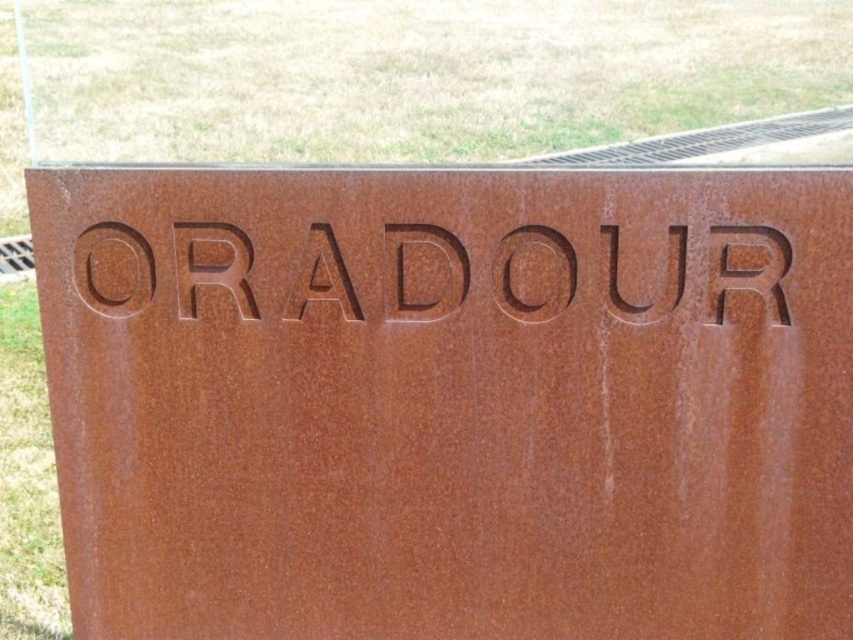
You are a landscape designer planning to place a new bench in the garden. The bench requires a space wider than the rusty metal sign at center but narrower than the brown grass at upper center. Is there enough space between them for the bench?

The rusty metal sign at center is narrower than the brown grass at upper center. Since the bench requires a space wider than the sign but narrower than the grass area, there is sufficient space between their widths to accommodate the bench.

You are standing in a field and see the rusty metal sign at center. If you walk directly towards the sign, will you first encounter the grass or the sign?

The rusty metal sign at center is located at point (450, 403), so you will first encounter the sign before the grass since it is positioned closer to your viewpoint.

You are standing in a field and see the rusty metal sign at center and the brown grass at upper center. Which object is closer to you?

The rusty metal sign at center is closer to you because it is in front of the brown grass at upper center.